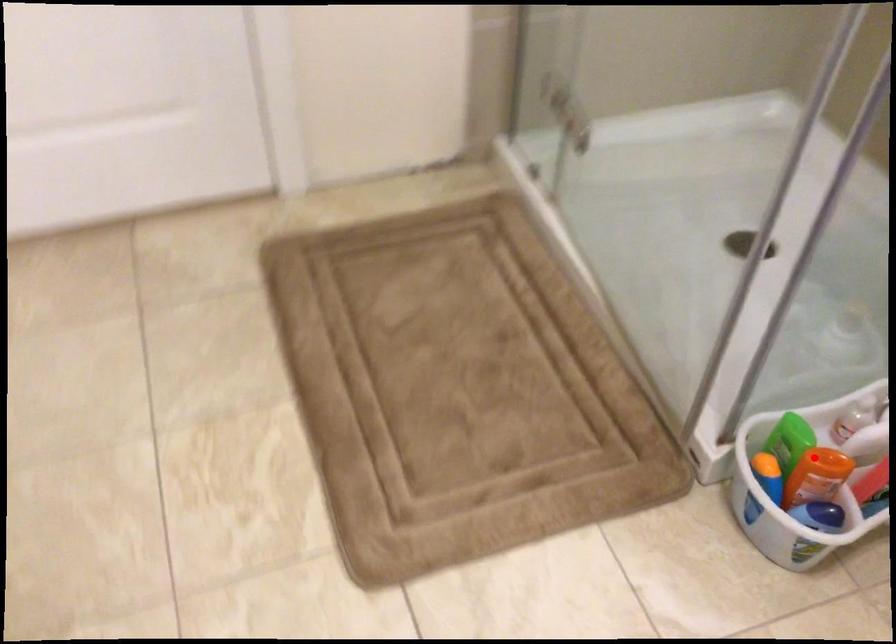
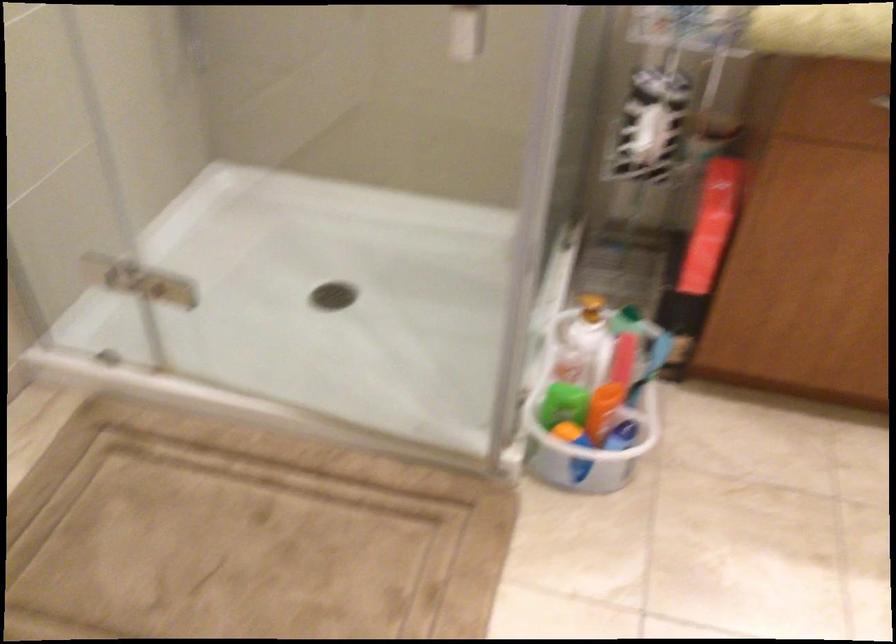
Question: I am providing you with two images of the same scene from different viewpoints. Image1 has a red point marked. In image2, the corresponding 3D location appears at what relative position? Reply with the corresponding letter.

Choices:
 (A) Closer
 (B) Farther

Answer: (B)